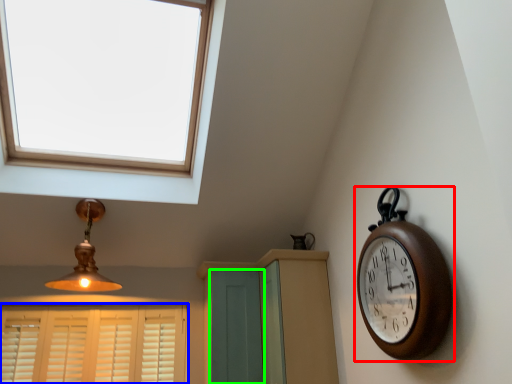
Question: Which object is positioned farthest from wall clock (highlighted by a red box)? Select from window (highlighted by a blue box) and screen door (highlighted by a green box).

Choices:
 (A) window
 (B) screen door

Answer: (A)